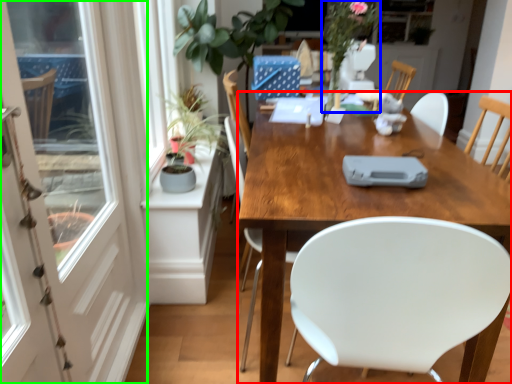
Question: Which object is the closest to the desk (highlighted by a red box)? Choose among these: floral arrangement (highlighted by a blue box) or screen door (highlighted by a green box).

Choices:
 (A) floral arrangement
 (B) screen door

Answer: (A)